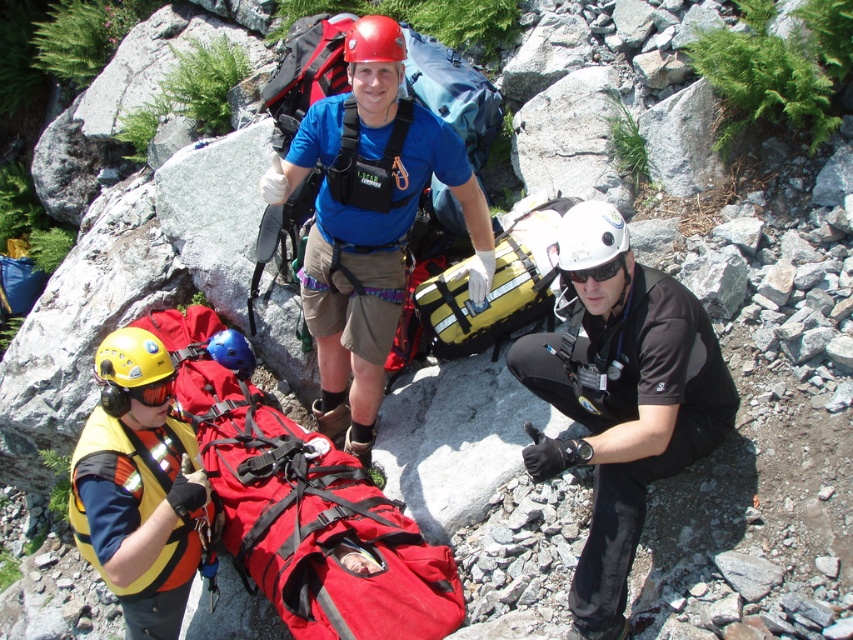
Can you confirm if yellow fabric backpack at center is positioned to the left of black matte goggles at center?

Indeed, yellow fabric backpack at center is positioned on the left side of black matte goggles at center.

Which is in front, point (469, 304) or point (614, 259)?

Point (614, 259)

The width and height of the screenshot is (853, 640). Describe the element at coordinates (494, 289) in the screenshot. I see `yellow fabric backpack at center` at that location.

The width and height of the screenshot is (853, 640). I want to click on yellow fabric backpack at center, so click(494, 289).

Can you confirm if red fabric stretcher at center is taller than yellow fabric backpack at center?

Indeed, red fabric stretcher at center has a greater height compared to yellow fabric backpack at center.

What do you see at coordinates (310, 516) in the screenshot?
I see `red fabric stretcher at center` at bounding box center [310, 516].

Does point (294, 612) come farther from viewer compared to point (491, 316)?

No, (294, 612) is in front of (491, 316).

Identify the location of red fabric stretcher at center. Image resolution: width=853 pixels, height=640 pixels. (310, 516).

Can you confirm if orange/yellow fabric safety vest at lower left is shorter than red matte helmet at center?

In fact, orange/yellow fabric safety vest at lower left may be taller than red matte helmet at center.

Does orange/yellow fabric safety vest at lower left have a lesser width compared to red matte helmet at center?

No, orange/yellow fabric safety vest at lower left is not thinner than red matte helmet at center.

The image size is (853, 640). Describe the element at coordinates (136, 493) in the screenshot. I see `orange/yellow fabric safety vest at lower left` at that location.

You are a GUI agent. You are given a task and a screenshot of the screen. Output one action in this format:
    pyautogui.click(x=<x>, y=<y>)
    Task: Click on the orange/yellow fabric safety vest at lower left
    This screenshot has width=853, height=640.
    Given the screenshot: What is the action you would take?
    pyautogui.click(x=136, y=493)